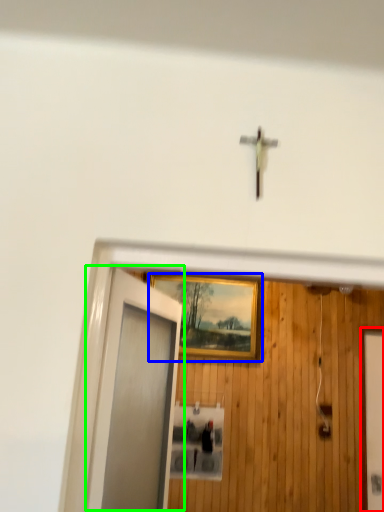
Question: Which object is the farthest from elevator door (highlighted by a red box)? Choose among these: picture frame (highlighted by a blue box) or door (highlighted by a green box).

Choices:
 (A) picture frame
 (B) door

Answer: (B)